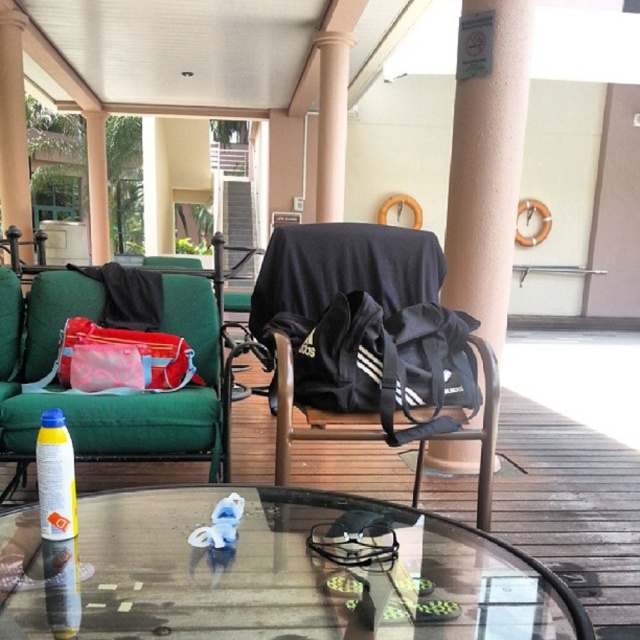
You are organizing items on a round glass coffee table. You have a black fabric bag at center and a yellow matte spray can at center. Which item is positioned higher on the table?

The black fabric bag at center is above the yellow matte spray can at center, so it is positioned higher on the table.